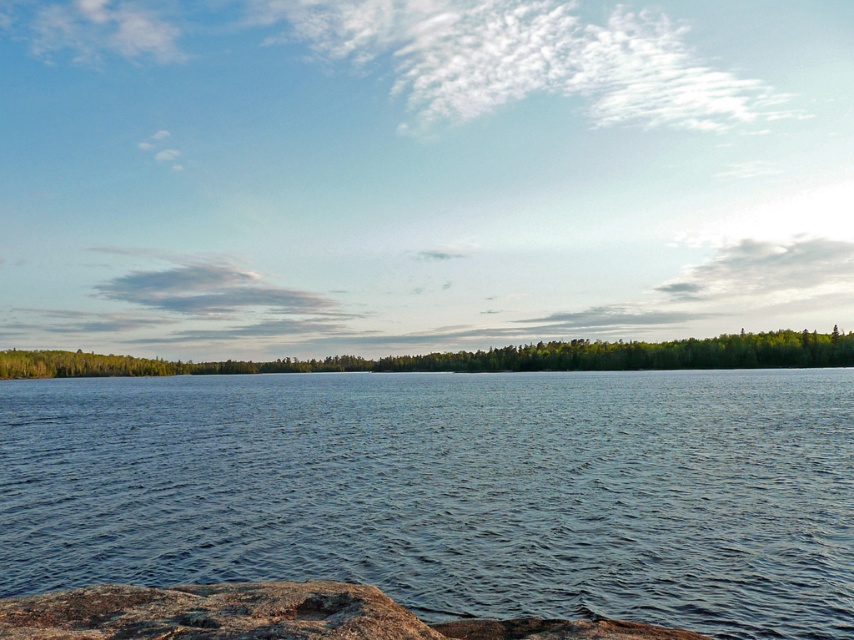
Can you confirm if brown rough rock at lower left is positioned above green matte tree at center?

Incorrect, brown rough rock at lower left is not positioned above green matte tree at center.

Between brown rough rock at lower left and green matte tree at center, which one is positioned lower?

brown rough rock at lower left is below.

Is point (314, 604) less distant than point (665, 356)?

Yes.

Where is `brown rough rock at lower left`? brown rough rock at lower left is located at coordinates (212, 612).

Does blue water at center appear under green matte tree at center?

Yes.

Can you confirm if blue water at center is thinner than green matte tree at center?

Correct, blue water at center's width is less than green matte tree at center's.

This screenshot has height=640, width=854. In order to click on blue water at center in this screenshot , I will do pyautogui.click(x=449, y=490).

I want to click on blue water at center, so click(449, 490).

Is blue water at center in front of brown rough rock at lower left?

No, it is behind brown rough rock at lower left.

Locate an element on the screen. This screenshot has height=640, width=854. blue water at center is located at coordinates (449, 490).

Describe the element at coordinates (449, 490) in the screenshot. I see `blue water at center` at that location.

Locate an element on the screen. The image size is (854, 640). blue water at center is located at coordinates (449, 490).